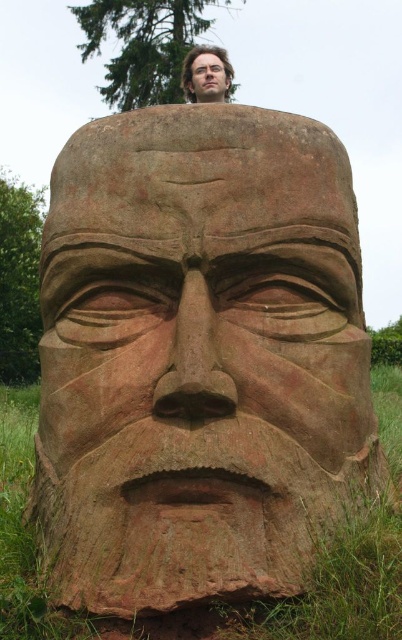
Question: Can you confirm if smooth brown wooden head at upper center is positioned to the right of smooth wood face at upper center?

Choices:
 (A) yes
 (B) no

Answer: (A)

Question: Is smooth brown wooden head at upper center smaller than smooth wood face at upper center?

Choices:
 (A) yes
 (B) no

Answer: (A)

Question: Which point is closer to the camera?

Choices:
 (A) smooth wood face at upper center
 (B) smooth brown wooden head at upper center

Answer: (A)

Question: Does smooth brown wooden head at upper center appear on the left side of smooth wood face at upper center?

Choices:
 (A) no
 (B) yes

Answer: (A)

Question: Among these objects, which one is farthest from the camera?

Choices:
 (A) smooth wood face at upper center
 (B) smooth brown wooden head at upper center

Answer: (B)